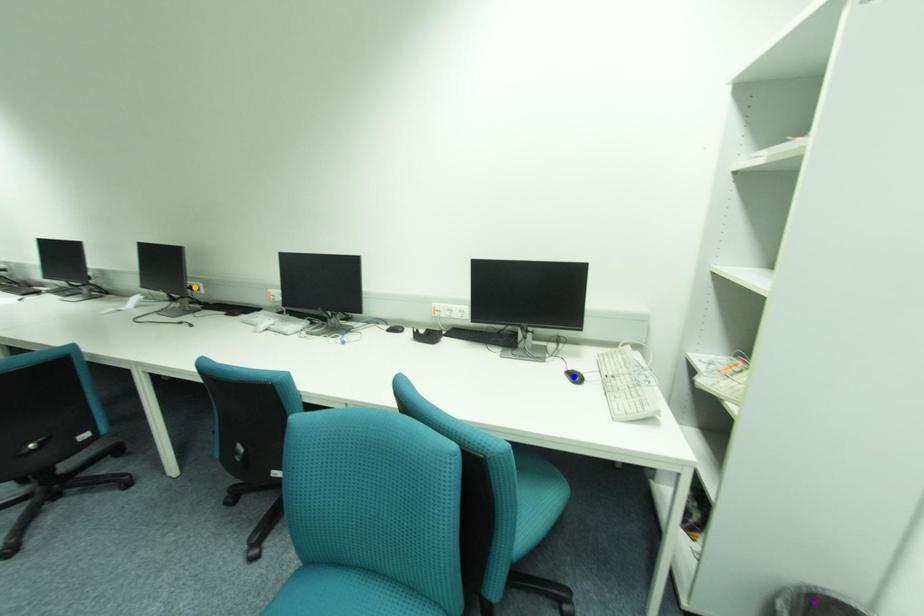
Order these from nearest to farthest:
- orange point
- blue point
- purple point

orange point → blue point → purple point